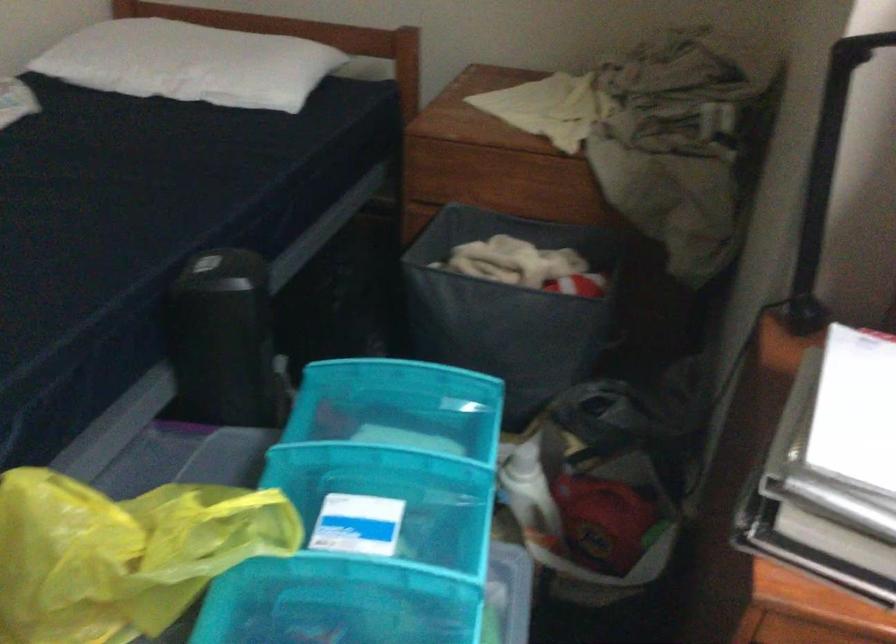
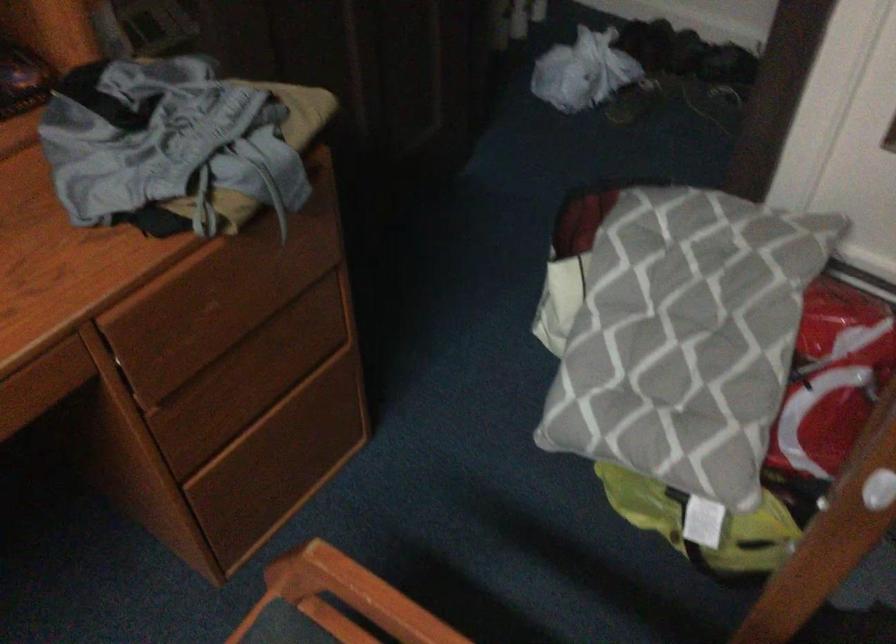
First-person continuous shooting, in which direction is the camera rotating?

The camera's rotation is toward left-down.